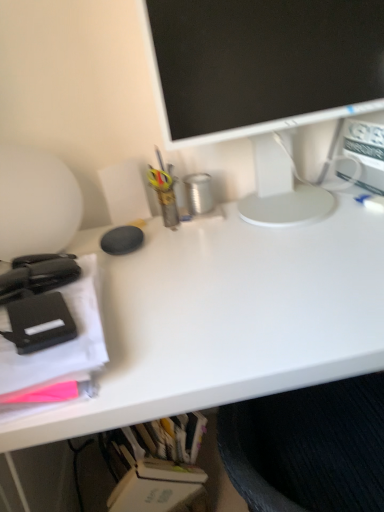
This screenshot has width=384, height=512. Find the location of `free space above matte black stapler at left, which appears as the 2th office supplies when viewed from the back (from a real-world perspective)`. free space above matte black stapler at left, which appears as the 2th office supplies when viewed from the back (from a real-world perspective) is located at coordinates (40, 291).